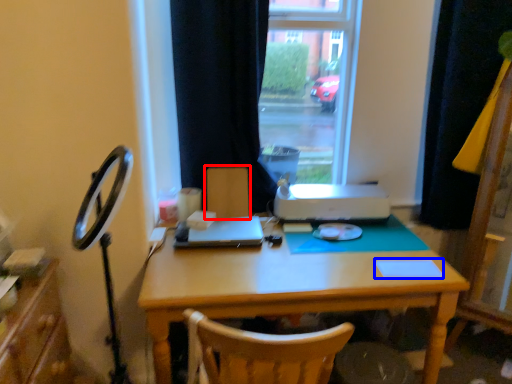
Question: Which point is further to the camera, armchair (highlighted by a red box) or notepad (highlighted by a blue box)?

Choices:
 (A) armchair
 (B) notepad

Answer: (A)